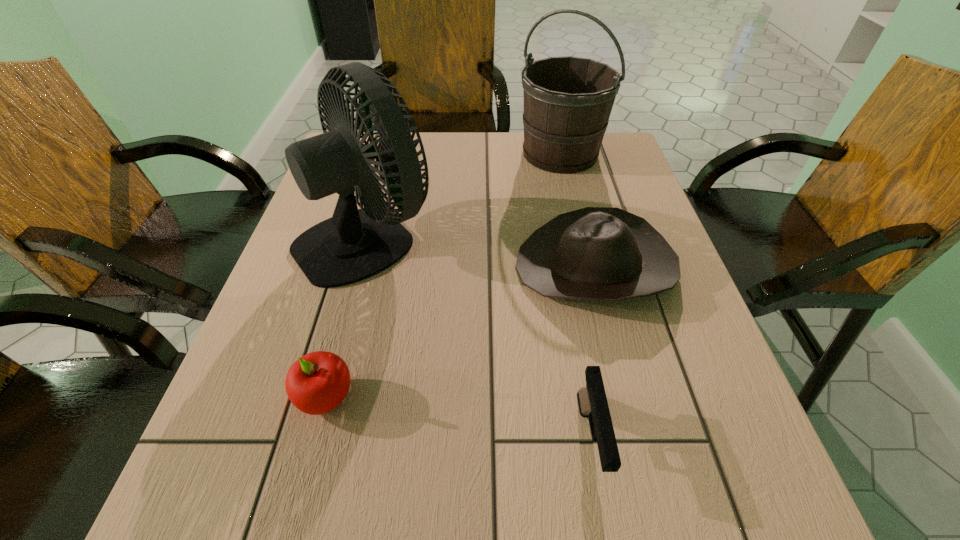
This screenshot has width=960, height=540. I want to click on object that can be found as the fourth closest to the pistol, so click(x=568, y=100).

Select which object is the third closest to the apple. Please provide its 2D coordinates. Your answer should be formatted as a tuple, i.e. [(x, y)], where the tuple contains the x and y coordinates of a point satisfying the conditions above.

[(592, 401)]

Image resolution: width=960 pixels, height=540 pixels. I want to click on blank area in the image that satisfies the following two spatial constraints: 1. in front of the fan to direct airflow; 2. on the back side of the cowboy hat, so click(359, 267).

Find the location of `vacant point that satisfies the following two spatial constraints: 1. in front of the fan to direct airflow; 2. on the left side of the apple`. vacant point that satisfies the following two spatial constraints: 1. in front of the fan to direct airflow; 2. on the left side of the apple is located at coordinates [324, 397].

At what (x,y) coordinates should I click in order to perform the action: click on vacant space that satisfies the following two spatial constraints: 1. in front of the apple to direct airflow; 2. on the left side of the fan. Please return your answer as a coordinate pair (x, y). Looking at the image, I should click on (324, 397).